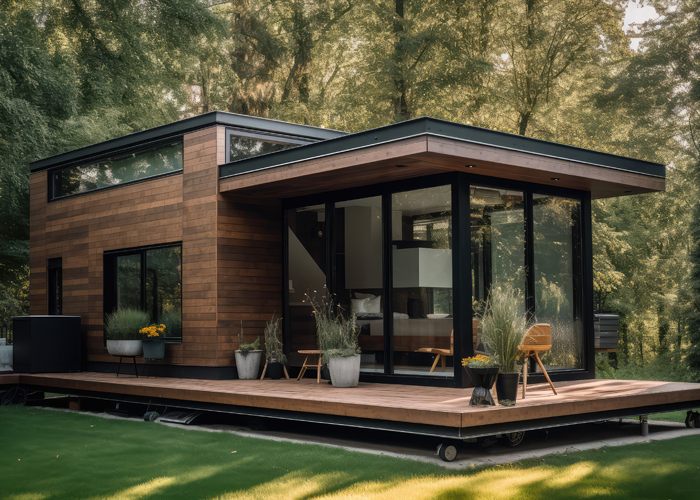
Locate an element on the screen. The height and width of the screenshot is (500, 700). potted plants is located at coordinates (507, 385), (480, 370), (344, 360), (273, 356), (250, 350), (158, 336), (127, 335).